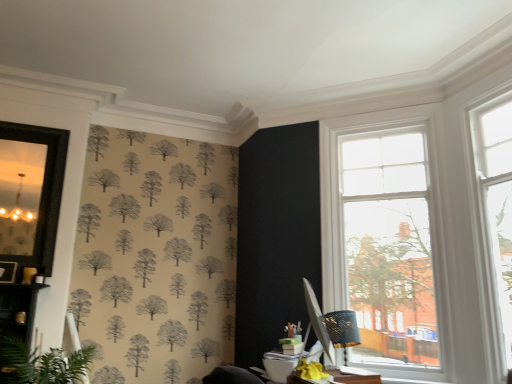
Question: Considering the relative sizes of clear glass window at upper right, which ranks as the 2th window in left-to-right order, and matte black mirror at left in the image provided, is clear glass window at upper right, which ranks as the 2th window in left-to-right order, thinner than matte black mirror at left?

Choices:
 (A) yes
 (B) no

Answer: (B)

Question: From the image's perspective, is clear glass window at upper right, the first window in the right-to-left sequence, below matte black mirror at left?

Choices:
 (A) yes
 (B) no

Answer: (A)

Question: Is clear glass window at upper right, which ranks as the 2th window in left-to-right order, positioned with its back to matte black mirror at left?

Choices:
 (A) no
 (B) yes

Answer: (A)

Question: From the image's perspective, is clear glass window at upper right, the first window in the right-to-left sequence, on matte black mirror at left?

Choices:
 (A) no
 (B) yes

Answer: (A)

Question: Considering the relative sizes of clear glass window at upper right, which ranks as the 2th window in left-to-right order, and matte black mirror at left in the image provided, is clear glass window at upper right, which ranks as the 2th window in left-to-right order, taller than matte black mirror at left?

Choices:
 (A) no
 (B) yes

Answer: (B)

Question: Is clear glass window at upper right, the first window in the right-to-left sequence, inside or outside of matte black mirror at left?

Choices:
 (A) inside
 (B) outside

Answer: (B)

Question: In terms of height, does clear glass window at upper right, the first window in the right-to-left sequence, look taller or shorter compared to matte black mirror at left?

Choices:
 (A) tall
 (B) short

Answer: (A)

Question: From a real-world perspective, is clear glass window at upper right, which ranks as the 2th window in left-to-right order, above or below matte black mirror at left?

Choices:
 (A) above
 (B) below

Answer: (B)

Question: Based on their sizes in the image, would you say clear glass window at upper right, which ranks as the 2th window in left-to-right order, is bigger or smaller than matte black mirror at left?

Choices:
 (A) big
 (B) small

Answer: (A)

Question: From the image's perspective, is matte black lampshade at right located above or below green leafy plant at lower left?

Choices:
 (A) below
 (B) above

Answer: (B)

Question: Would you say matte black lampshade at right is to the left or to the right of green leafy plant at lower left in the picture?

Choices:
 (A) left
 (B) right

Answer: (B)

Question: From a real-world perspective, is matte black lampshade at right physically located above or below green leafy plant at lower left?

Choices:
 (A) below
 (B) above

Answer: (B)

Question: Is matte black lampshade at right inside or outside of green leafy plant at lower left?

Choices:
 (A) outside
 (B) inside

Answer: (A)

Question: In terms of width, does clear glass window at upper right, placed as the second window when sorted from right to left, look wider or thinner when compared to matte black lampshade at right?

Choices:
 (A) wide
 (B) thin

Answer: (A)

Question: Relative to matte black lampshade at right, is clear glass window at upper right, placed as the second window when sorted from right to left, in front or behind?

Choices:
 (A) front
 (B) behind

Answer: (A)